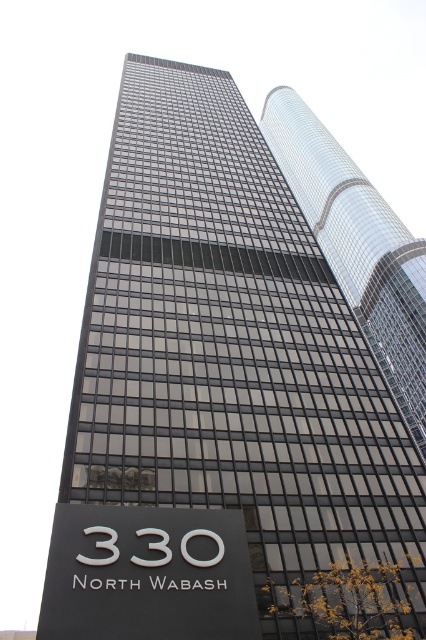
You are standing in front of the skyscraper and want to read both the black matte sign at lower center and the white glossy sign at center. Which sign will you need to look up more to read?

The black matte sign at lower center is taller than the white glossy sign at center, so you will need to look up more to read the black matte sign at lower center because it is taller and positioned lower down.

Looking at this image, you are standing in front of the skyscraper and want to read the black matte sign at lower center. Which direction should you look relative to the glossy glass skyscraper at upper center?

The black matte sign at lower center is located below the glossy glass skyscraper at upper center, so you should look downward from the glossy glass skyscraper at upper center to see the black matte sign at lower center.